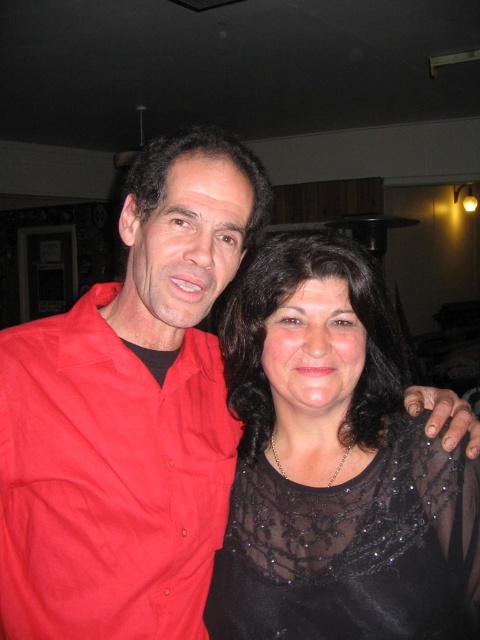
Who is higher up, black sheer dress at center or matte red shirt at left?

black sheer dress at center

The height and width of the screenshot is (640, 480). Describe the element at coordinates (335, 465) in the screenshot. I see `black sheer dress at center` at that location.

The width and height of the screenshot is (480, 640). Find the location of `black sheer dress at center`. black sheer dress at center is located at coordinates (335, 465).